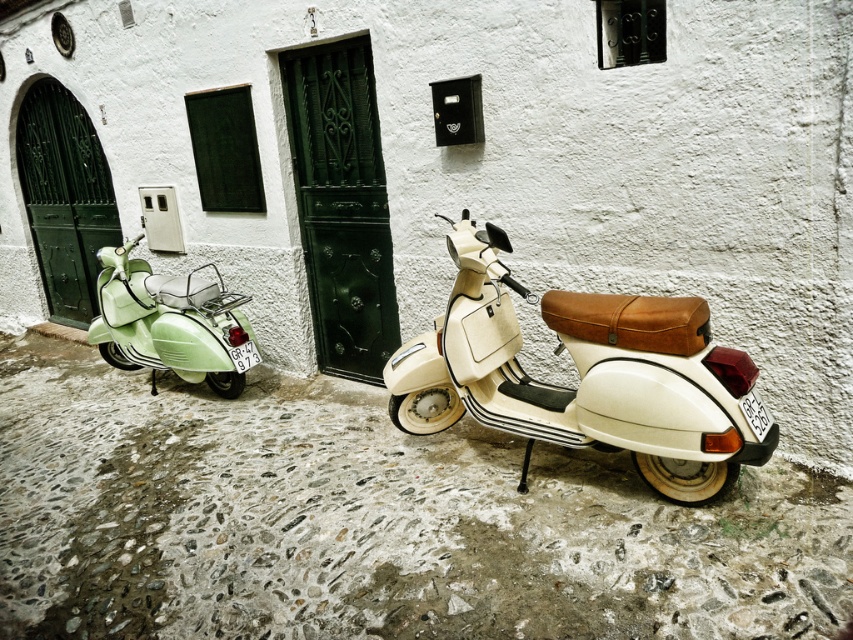
Measure the distance between point (494,269) and camera.

3.46 meters

Does matte cream scooter at center have a larger size compared to pastel green matte scooter at left?

No.

Find the location of `matte cream scooter at center`. matte cream scooter at center is located at coordinates (585, 376).